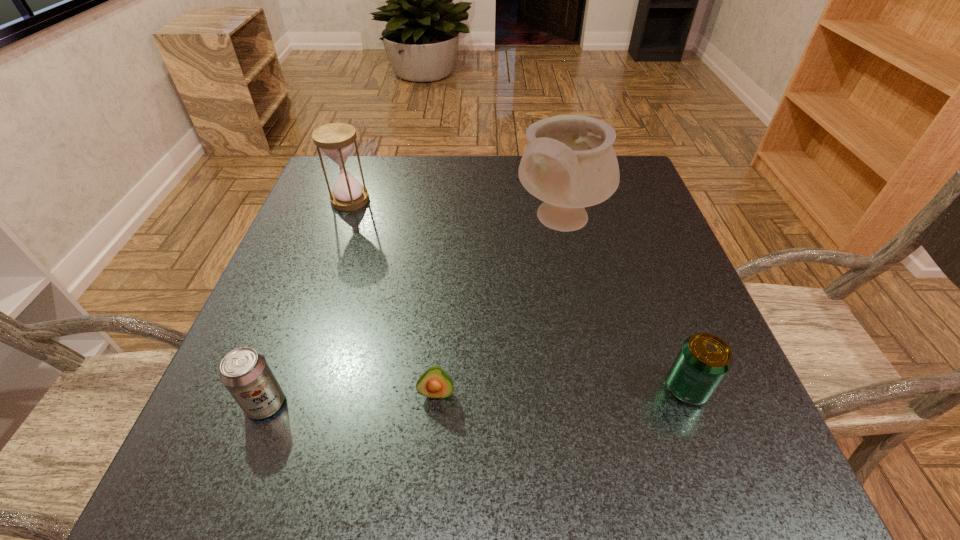
Where is `vacant space located on the back of the rightmost object`? The height and width of the screenshot is (540, 960). vacant space located on the back of the rightmost object is located at coordinates (671, 345).

The width and height of the screenshot is (960, 540). What are the coordinates of `blank space located 0.060m on the cut side of the avocado` in the screenshot? It's located at (433, 441).

Where is `pottery situated at the far edge`? pottery situated at the far edge is located at coordinates (569, 163).

Find the location of `hourglass at the far edge`. hourglass at the far edge is located at coordinates (336, 140).

In order to click on hourglass located in the left edge section of the desktop in this screenshot , I will do (x=336, y=140).

Locate an element on the screen. The height and width of the screenshot is (540, 960). beer can that is at the left edge is located at coordinates (246, 374).

Locate an element on the screen. pottery at the right edge is located at coordinates (569, 163).

The image size is (960, 540). Identify the location of beer can situated at the right edge. (704, 359).

Locate an element on the screen. object present at the far left corner is located at coordinates (336, 140).

Find the location of a particular element. The height and width of the screenshot is (540, 960). object situated at the far right corner is located at coordinates (569, 163).